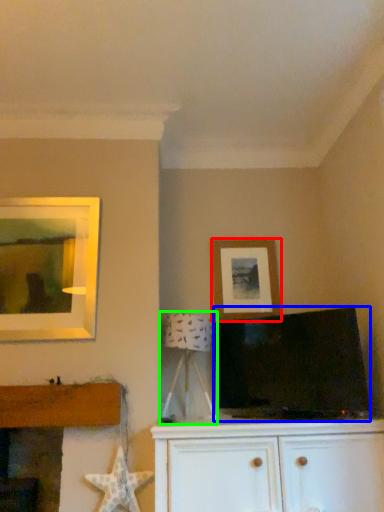
Question: Which object is the closest to the picture frame (highlighted by a red box)? Choose among these: television (highlighted by a blue box) or table lamp (highlighted by a green box).

Choices:
 (A) television
 (B) table lamp

Answer: (B)